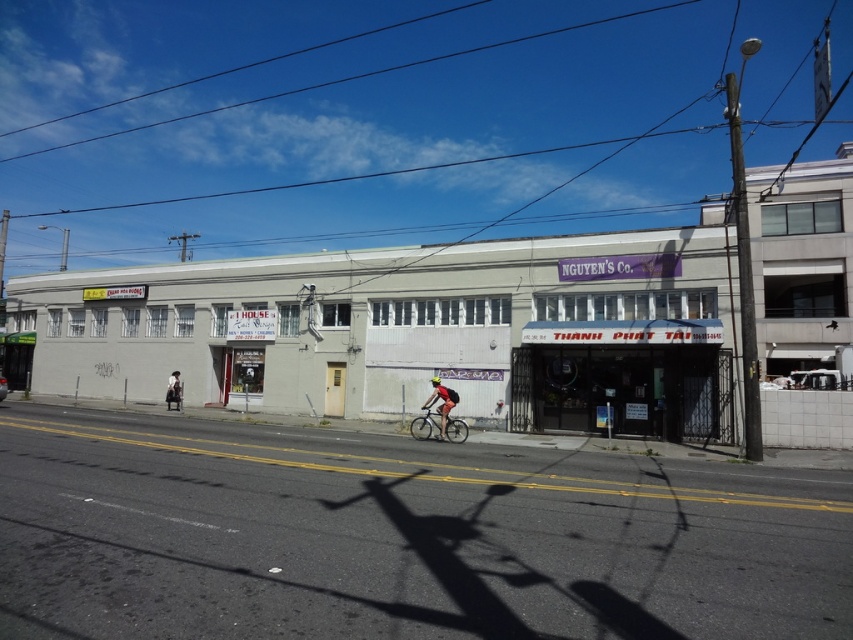
Question: Among these points, which one is nearest to the camera?

Choices:
 (A) (695, 388)
 (B) (426, 426)

Answer: (B)

Question: Is metallic silver storefront at center to the left of shiny red bicycle at center from the viewer's perspective?

Choices:
 (A) yes
 (B) no

Answer: (B)

Question: Which point appears closest to the camera in this image?

Choices:
 (A) (592, 426)
 (B) (166, 404)
 (C) (427, 417)

Answer: (C)

Question: Does shiny metallic bicycle at center have a greater width compared to light brown leather jacket at center?

Choices:
 (A) yes
 (B) no

Answer: (A)

Question: Is metallic silver storefront at center to the left of shiny metallic bicycle at center from the viewer's perspective?

Choices:
 (A) yes
 (B) no

Answer: (B)

Question: Which of the following is the closest to the observer?

Choices:
 (A) (172, 392)
 (B) (460, 436)

Answer: (B)